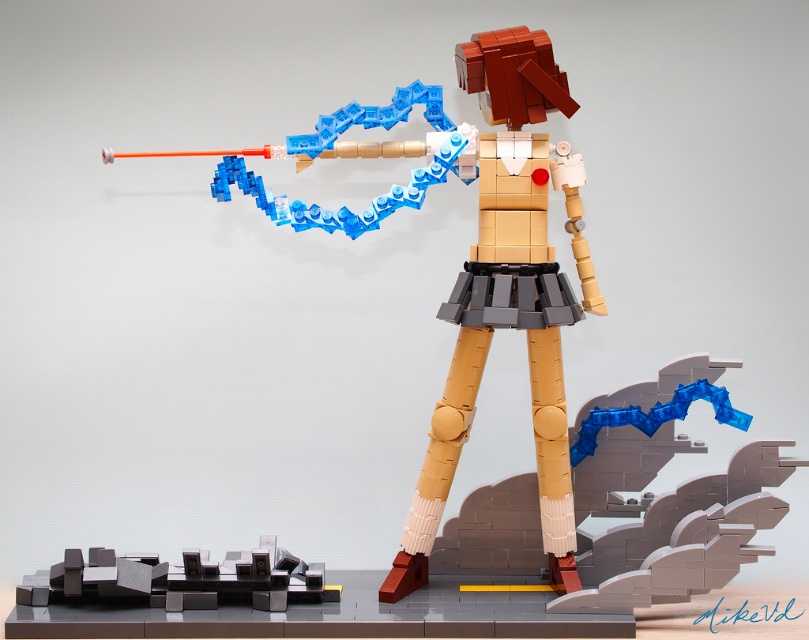
Question: Which point is closer to the camera?

Choices:
 (A) matte brown figure at center
 (B) dark gray plastic cityscape at lower left

Answer: (A)

Question: Is matte brown figure at center to the left of dark gray plastic cityscape at lower left from the viewer's perspective?

Choices:
 (A) yes
 (B) no

Answer: (B)

Question: Which object appears closest to the camera in this image?

Choices:
 (A) matte brown figure at center
 (B) dark gray plastic cityscape at lower left

Answer: (A)

Question: Does matte brown figure at center have a greater width compared to dark gray plastic cityscape at lower left?

Choices:
 (A) yes
 (B) no

Answer: (A)

Question: Among these objects, which one is nearest to the camera?

Choices:
 (A) matte brown figure at center
 (B) dark gray plastic cityscape at lower left

Answer: (A)

Question: Does matte brown figure at center appear on the left side of dark gray plastic cityscape at lower left?

Choices:
 (A) no
 (B) yes

Answer: (A)